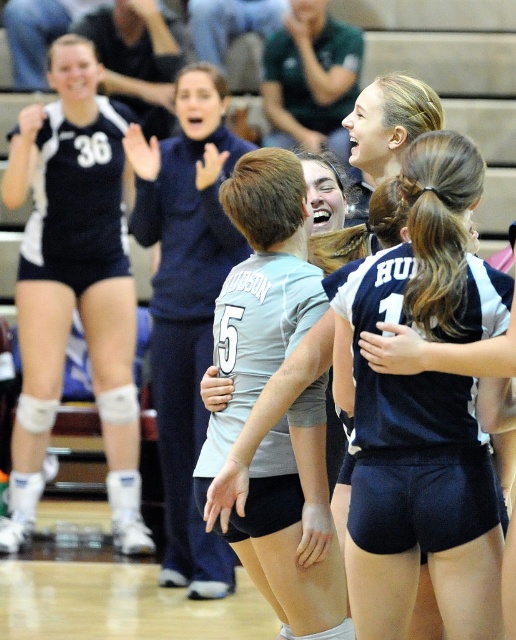
Question: Estimate the real-world distances between objects in this image. Which object is closer to the matte blue sweatshirt at center?

Choices:
 (A) light gray jersey at center
 (B) matte black uniform at center

Answer: (B)

Question: Does matte black uniform at center appear on the right side of matte blue sweatshirt at center?

Choices:
 (A) no
 (B) yes

Answer: (A)

Question: Does light gray jersey at center appear on the left side of matte blue sweatshirt at center?

Choices:
 (A) no
 (B) yes

Answer: (A)

Question: Which point is closer to the camera?

Choices:
 (A) light gray jersey at center
 (B) matte blue sweatshirt at center
 (C) matte black uniform at center

Answer: (A)

Question: Which of the following is the farthest from the observer?

Choices:
 (A) (378, 445)
 (B) (137, 148)
 (C) (68, 202)

Answer: (C)

Question: Is matte black uniform at center below matte blue sweatshirt at center?

Choices:
 (A) no
 (B) yes

Answer: (A)